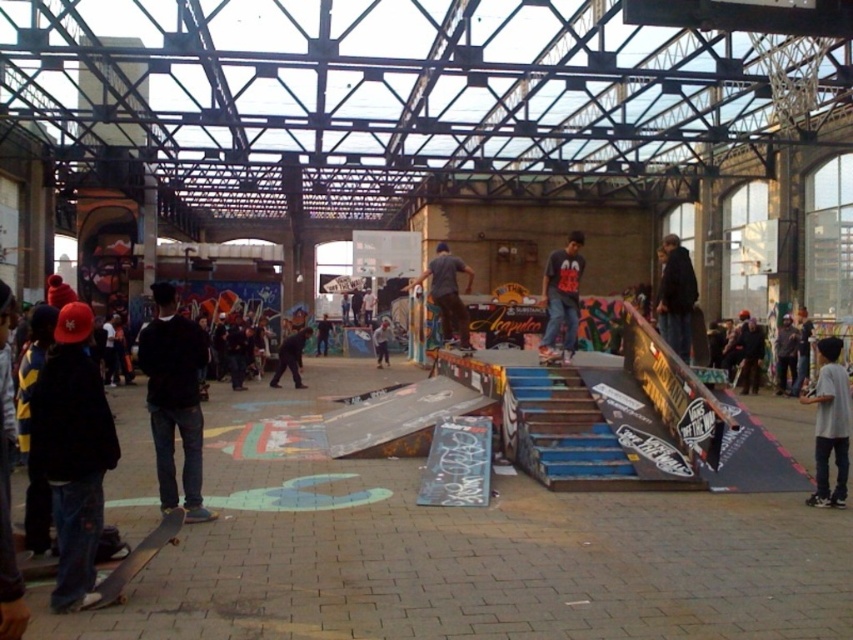
Question: Which of the following is the farthest from the observer?

Choices:
 (A) wooden skateboard at center
 (B) dark gray t-shirt at center
 (C) wooden skateboard at lower left
 (D) black matte jacket at center

Answer: (B)

Question: From the image, what is the correct spatial relationship of dark gray shirt at center in relation to wooden skateboard at lower left?

Choices:
 (A) below
 (B) above

Answer: (B)

Question: Which point appears closest to the camera in this image?

Choices:
 (A) (442, 269)
 (B) (686, 328)
 (C) (554, 285)
 (D) (154, 540)

Answer: (D)

Question: Considering the real-world distances, which object is farthest from the wooden skateboard at center?

Choices:
 (A) black matte jacket at center
 (B) wooden skateboard at lower left
 (C) dark gray shirt at center
 (D) dark blue jeans at center

Answer: (B)

Question: Is black matte jacket at center bigger than dark gray t-shirt at center?

Choices:
 (A) no
 (B) yes

Answer: (B)

Question: Is dark blue jeans at center further to the viewer compared to wooden skateboard at center?

Choices:
 (A) no
 (B) yes

Answer: (A)